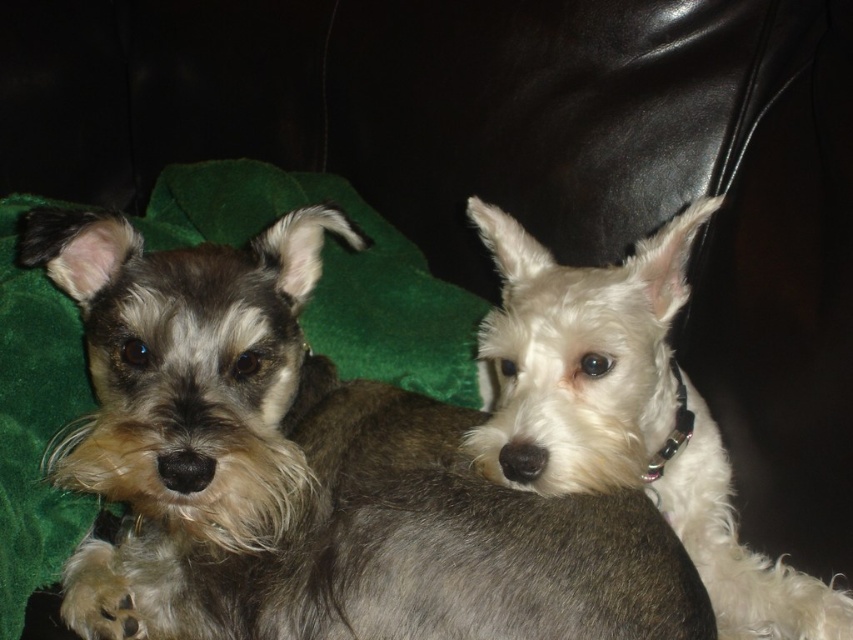
Which is above, gray fur dog at center or white fur dog at upper right?

white fur dog at upper right

Can you confirm if gray fur dog at center is thinner than white fur dog at upper right?

A: In fact, gray fur dog at center might be wider than white fur dog at upper right.

Who is more forward, (x=393, y=477) or (x=503, y=314)?

Positioned in front is point (x=393, y=477).

You are a GUI agent. You are given a task and a screenshot of the screen. Output one action in this format:
    pyautogui.click(x=<x>, y=<y>)
    Task: Click on the gray fur dog at center
    Image resolution: width=853 pixels, height=640 pixels.
    Given the screenshot: What is the action you would take?
    pyautogui.click(x=310, y=472)